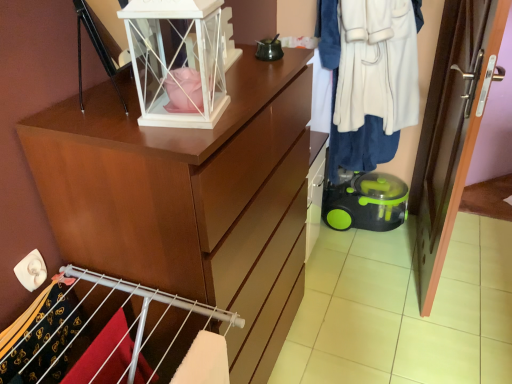
Question: From the image's perspective, is green plastic vacuum cleaner at lower right located above or below white plush coat at right?

Choices:
 (A) below
 (B) above

Answer: (A)

Question: Choose the correct answer: Is green plastic vacuum cleaner at lower right inside white plush coat at right or outside it?

Choices:
 (A) inside
 (B) outside

Answer: (B)

Question: Is green plastic vacuum cleaner at lower right wider or thinner than white plush coat at right?

Choices:
 (A) thin
 (B) wide

Answer: (A)

Question: Visually, is white plush coat at right positioned to the left or to the right of green plastic vacuum cleaner at lower right?

Choices:
 (A) left
 (B) right

Answer: (A)

Question: Is white plush coat at right in front of or behind green plastic vacuum cleaner at lower right in the image?

Choices:
 (A) front
 (B) behind

Answer: (A)

Question: Is point (348, 167) closer or farther from the camera than point (393, 226)?

Choices:
 (A) farther
 (B) closer

Answer: (B)

Question: Considering the positions of white plush coat at right and green plastic vacuum cleaner at lower right in the image, is white plush coat at right bigger or smaller than green plastic vacuum cleaner at lower right?

Choices:
 (A) big
 (B) small

Answer: (A)